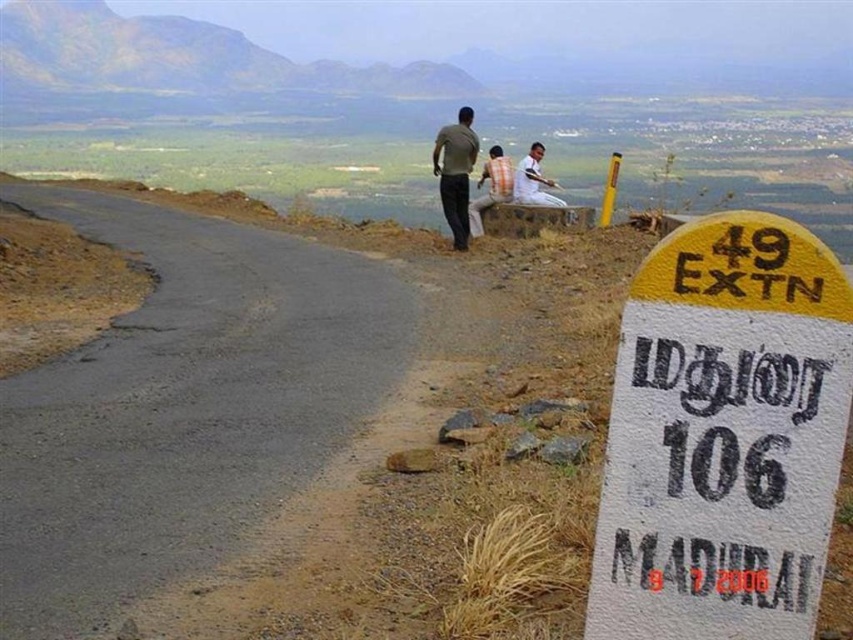
Can you confirm if dark gray shirt at upper center is positioned to the right of light brown wooden stick at upper center?

Incorrect, dark gray shirt at upper center is not on the right side of light brown wooden stick at upper center.

Does dark gray shirt at upper center come behind light brown wooden stick at upper center?

That is False.

Between point (451, 173) and point (541, 150), which one is positioned behind?

Point (541, 150)

You are a GUI agent. You are given a task and a screenshot of the screen. Output one action in this format:
    pyautogui.click(x=<x>, y=<y>)
    Task: Click on the dark gray shirt at upper center
    This screenshot has height=640, width=853.
    Given the screenshot: What is the action you would take?
    pyautogui.click(x=456, y=172)

Can you confirm if black asphalt road at left is positioned above light brown wooden stick at upper center?

No, black asphalt road at left is not above light brown wooden stick at upper center.

Who is lower down, black asphalt road at left or light brown wooden stick at upper center?

black asphalt road at left is below.

Where is `black asphalt road at left`? This screenshot has height=640, width=853. black asphalt road at left is located at coordinates (183, 406).

Identify the location of black asphalt road at left. (183, 406).

Can you confirm if black asphalt road at left is positioned to the left of orange striped shirt at center?

Indeed, black asphalt road at left is positioned on the left side of orange striped shirt at center.

Which is more to the right, black asphalt road at left or orange striped shirt at center?

Positioned to the right is orange striped shirt at center.

Image resolution: width=853 pixels, height=640 pixels. In order to click on black asphalt road at left in this screenshot , I will do `click(183, 406)`.